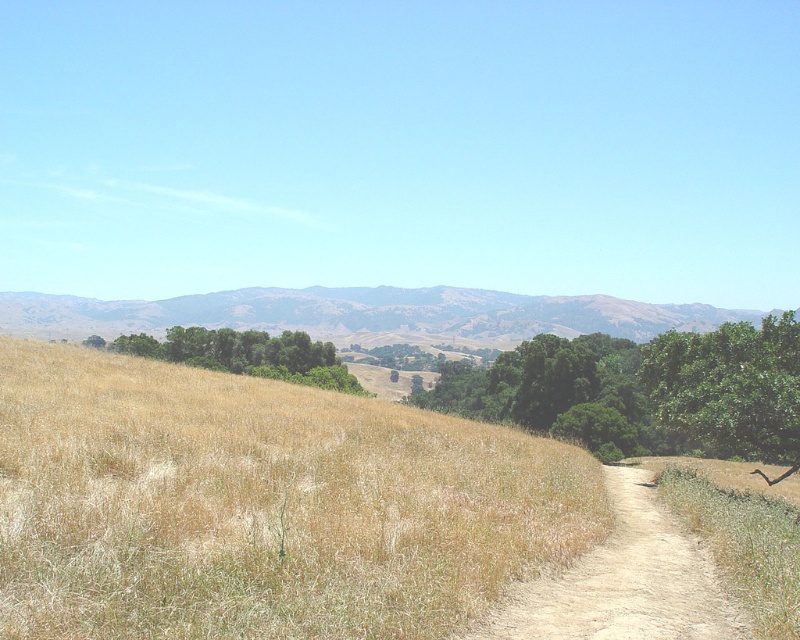
Question: Estimate the real-world distances between objects in this image. Which object is closer to the dusty sand path at center?

Choices:
 (A) green leafy trees at center
 (B) green leafy tree at right
 (C) brown textured mountain at upper center
 (D) dry grass at center

Answer: (D)

Question: Does green leafy tree at right have a larger size compared to green leafy trees at center?

Choices:
 (A) yes
 (B) no

Answer: (B)

Question: Based on their relative distances, which object is nearer to the dry grass at center?

Choices:
 (A) green leafy tree at right
 (B) brown textured mountain at upper center
 (C) dusty sand path at center
 (D) green leafy tree at center-right

Answer: (C)

Question: Which point is closer to the camera?

Choices:
 (A) (788, 449)
 (B) (165, 540)

Answer: (B)

Question: Can you confirm if dry grass at center is positioned to the right of green leafy trees at center?

Choices:
 (A) yes
 (B) no

Answer: (A)

Question: Does dry grass at center have a greater width compared to green leafy tree at center-right?

Choices:
 (A) no
 (B) yes

Answer: (A)